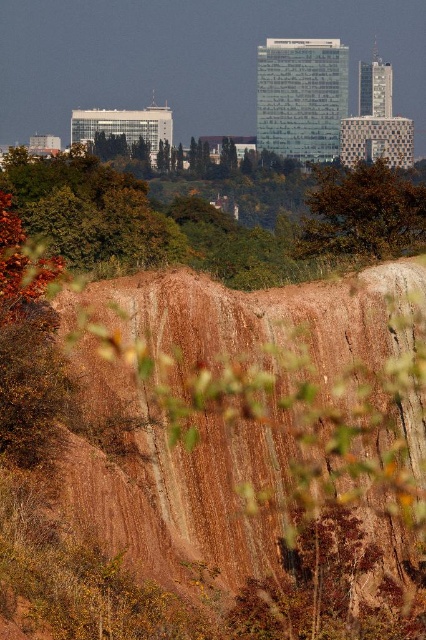
Does green leafy tree at upper center have a greater height compared to brown leafy tree at center?

No, green leafy tree at upper center is not taller than brown leafy tree at center.

Between green leafy tree at upper center and brown leafy tree at center, which one has more height?

With more height is brown leafy tree at center.

Is point (31, 205) behind point (324, 236)?

Yes, point (31, 205) is farther from viewer.

This screenshot has height=640, width=426. What are the coordinates of `green leafy tree at upper center` in the screenshot? It's located at (89, 211).